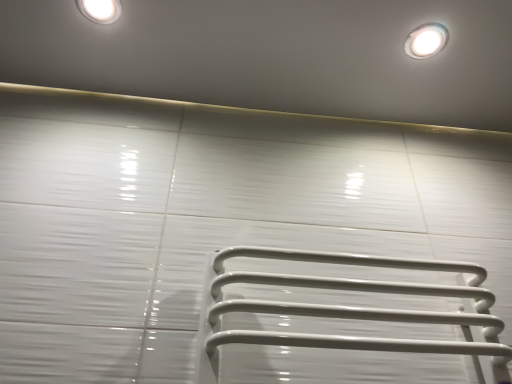
Where is `white glossy droplight at upper right`? The height and width of the screenshot is (384, 512). white glossy droplight at upper right is located at coordinates (426, 41).

Image resolution: width=512 pixels, height=384 pixels. What do you see at coordinates (426, 41) in the screenshot?
I see `white glossy droplight at upper right` at bounding box center [426, 41].

Measure the distance between white glossy droplight at upper right and camera.

white glossy droplight at upper right is 36.52 inches away from camera.

What do you see at coordinates (100, 10) in the screenshot? I see `white glossy light fixture at upper left` at bounding box center [100, 10].

The height and width of the screenshot is (384, 512). In order to click on white glossy light fixture at upper left in this screenshot , I will do `click(100, 10)`.

I want to click on white glossy droplight at upper right, so click(x=426, y=41).

Is white glossy droplight at upper right to the left or to the right of white glossy light fixture at upper left in the image?

white glossy droplight at upper right is to the right of white glossy light fixture at upper left.

Is white glossy droplight at upper right in front of or behind white glossy light fixture at upper left in the image?

white glossy droplight at upper right is positioned farther from the viewer than white glossy light fixture at upper left.

Which point is more distant from viewer, (431, 29) or (118, 14)?

Positioned behind is point (431, 29).

In the scene shown: From the image's perspective, which one is positioned lower, white glossy droplight at upper right or white glossy light fixture at upper left?

white glossy droplight at upper right appears lower in the image.

From a real-world perspective, is white glossy droplight at upper right over white glossy light fixture at upper left?

No, from a real-world perspective, white glossy droplight at upper right is not over white glossy light fixture at upper left

Does white glossy droplight at upper right have a lesser width compared to white glossy light fixture at upper left?

No.

Consider the image. In terms of height, does white glossy droplight at upper right look taller or shorter compared to white glossy light fixture at upper left?

Considering their sizes, white glossy droplight at upper right has more height than white glossy light fixture at upper left.

Based on the photo, considering the sizes of white glossy droplight at upper right and white glossy light fixture at upper left in the image, is white glossy droplight at upper right bigger or smaller than white glossy light fixture at upper left?

Considering their sizes, white glossy droplight at upper right takes up more space than white glossy light fixture at upper left.

Which is correct: white glossy droplight at upper right is inside white glossy light fixture at upper left, or outside of it?

white glossy droplight at upper right is outside white glossy light fixture at upper left.

Is white glossy droplight at upper right touching white glossy light fixture at upper left?

No, white glossy droplight at upper right is not making contact with white glossy light fixture at upper left.

Is white glossy droplight at upper right turned away from white glossy light fixture at upper left?

No.

The height and width of the screenshot is (384, 512). In order to click on lighting lying above the white glossy droplight at upper right (from the image's perspective) in this screenshot , I will do `click(100, 10)`.

Can you confirm if white glossy light fixture at upper left is positioned to the left of white glossy droplight at upper right?

Correct, you'll find white glossy light fixture at upper left to the left of white glossy droplight at upper right.

Between white glossy light fixture at upper left and white glossy droplight at upper right, which one is positioned in front?

white glossy light fixture at upper left.

Does point (80, 0) come in front of point (412, 32)?

Yes, point (80, 0) is closer to viewer.

From the image's perspective, which is above, white glossy light fixture at upper left or white glossy droplight at upper right?

white glossy light fixture at upper left is shown above in the image.

From a real-world perspective, is white glossy light fixture at upper left positioned above or below white glossy droplight at upper right?

Clearly, from a real-world perspective, white glossy light fixture at upper left is above white glossy droplight at upper right.

Which object is thinner, white glossy light fixture at upper left or white glossy droplight at upper right?

white glossy light fixture at upper left is thinner.

Considering the relative sizes of white glossy light fixture at upper left and white glossy droplight at upper right in the image provided, is white glossy light fixture at upper left shorter than white glossy droplight at upper right?

Yes.

Between white glossy light fixture at upper left and white glossy droplight at upper right, which one has smaller size?

With smaller size is white glossy light fixture at upper left.

Is white glossy droplight at upper right completely or partially inside white glossy light fixture at upper left?

No, white glossy droplight at upper right is not inside white glossy light fixture at upper left.

Is white glossy light fixture at upper left not close to white glossy droplight at upper right?

No, white glossy light fixture at upper left is not far from white glossy droplight at upper right.

Is white glossy light fixture at upper left aimed at white glossy droplight at upper right?

No.

How different are the orientations of white glossy light fixture at upper left and white glossy droplight at upper right in degrees?

1.05 degrees.

This screenshot has width=512, height=384. I want to click on lighting located above the white glossy droplight at upper right (from a real-world perspective), so click(x=100, y=10).

At what (x,y) coordinates should I click in order to perform the action: click on droplight that appears below the white glossy light fixture at upper left (from the image's perspective). Please return your answer as a coordinate pair (x, y). Image resolution: width=512 pixels, height=384 pixels. Looking at the image, I should click on (426, 41).

Identify the location of lighting above the white glossy droplight at upper right (from a real-world perspective). Image resolution: width=512 pixels, height=384 pixels. tap(100, 10).